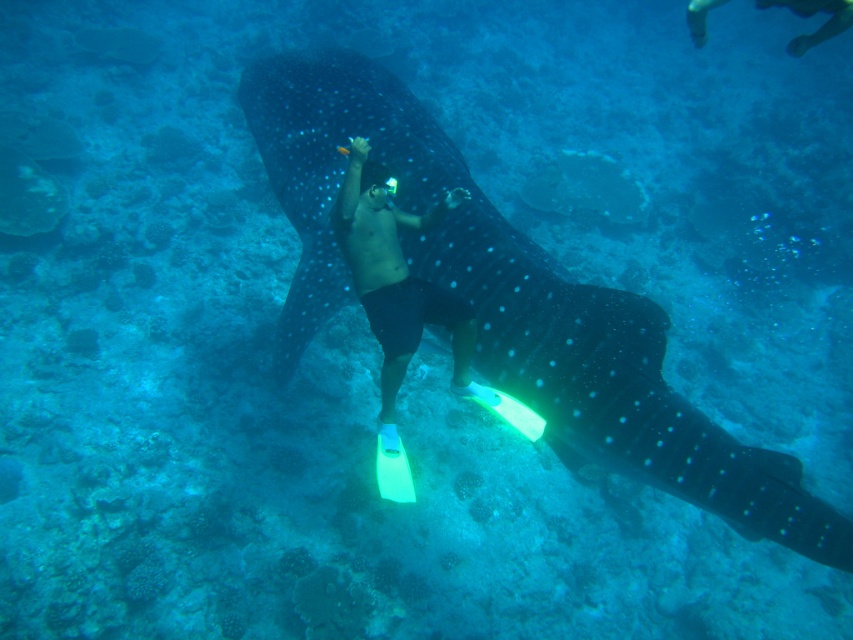
Question: Is spotted dark blue skin at center further to the viewer compared to matte black shorts at center?

Choices:
 (A) no
 (B) yes

Answer: (A)

Question: Which point is farther to the camera?

Choices:
 (A) spotted dark blue skin at center
 (B) matte black shorts at center

Answer: (B)

Question: Which object appears farthest from the camera in this image?

Choices:
 (A) spotted dark blue skin at center
 (B) matte black shorts at center

Answer: (B)

Question: Which of the following is the farthest from the observer?

Choices:
 (A) matte black shorts at center
 (B) spotted dark blue skin at center

Answer: (A)

Question: Does spotted dark blue skin at center have a larger size compared to matte black shorts at center?

Choices:
 (A) no
 (B) yes

Answer: (B)

Question: Is spotted dark blue skin at center above matte black shorts at center?

Choices:
 (A) yes
 (B) no

Answer: (B)